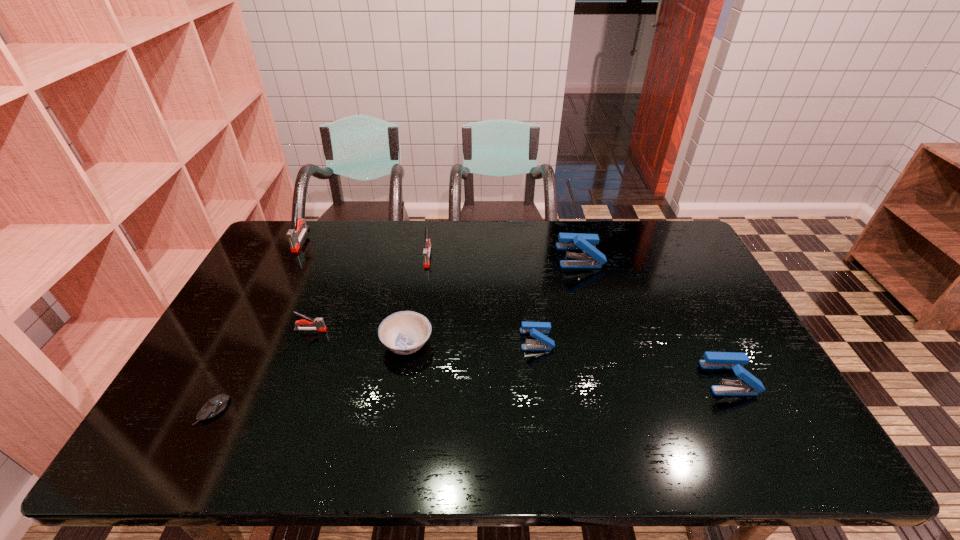
Identify the location of vacant space located 0.250m on the right of the leftmost blue stapler. (641, 340).

At what (x,y) coordinates should I click in order to perform the action: click on free space located on the right of the second shortest object. Please return your answer as a coordinate pair (x, y). The height and width of the screenshot is (540, 960). Looking at the image, I should click on (515, 343).

The height and width of the screenshot is (540, 960). Identify the location of vacant area located 0.220m on the back of the computer mouse. coord(254,330).

Locate an element on the screen. The image size is (960, 540). stapler positioned at the left edge is located at coordinates (294, 240).

The width and height of the screenshot is (960, 540). Find the location of `computer mouse present at the left edge`. computer mouse present at the left edge is located at coordinates (215, 405).

The height and width of the screenshot is (540, 960). I want to click on object that is at the right edge, so click(x=749, y=385).

At what (x,y) coordinates should I click in order to perform the action: click on object located in the far left corner section of the desktop. Please return your answer as a coordinate pair (x, y). The height and width of the screenshot is (540, 960). Looking at the image, I should click on (294, 240).

At what (x,y) coordinates should I click in order to perform the action: click on free space at the far edge of the desktop. Please return your answer as a coordinate pair (x, y). The height and width of the screenshot is (540, 960). Looking at the image, I should click on (559, 253).

Where is `vacant area at the near edge`? vacant area at the near edge is located at coordinates (621, 447).

Locate an element on the screen. The image size is (960, 540). free space at the left edge of the desktop is located at coordinates (209, 387).